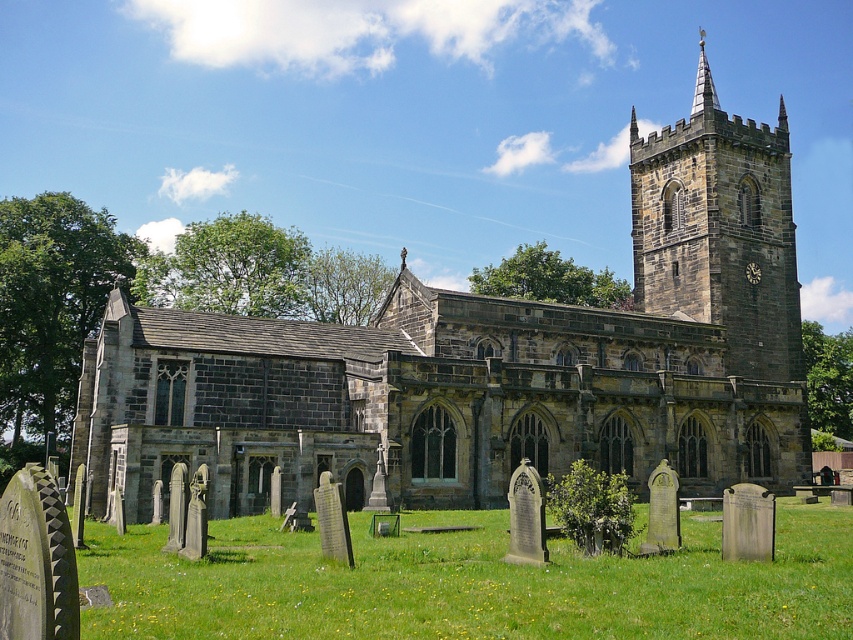
Question: Which object appears farthest from the camera in this image?

Choices:
 (A) dark gray stone tower at upper right
 (B) green grass at lower center
 (C) dark gray stone church at center

Answer: (A)

Question: Does green grass at lower center appear on the right side of dark gray stone tower at upper right?

Choices:
 (A) no
 (B) yes

Answer: (A)

Question: Where is dark gray stone church at center located in relation to green grass at lower center in the image?

Choices:
 (A) below
 (B) above

Answer: (B)

Question: Does dark gray stone church at center have a larger size compared to dark gray stone tower at upper right?

Choices:
 (A) no
 (B) yes

Answer: (B)

Question: Among these objects, which one is farthest from the camera?

Choices:
 (A) green grass at lower center
 (B) dark gray stone church at center

Answer: (B)

Question: Among these points, which one is nearest to the camera?

Choices:
 (A) (838, 573)
 (B) (730, 320)

Answer: (A)